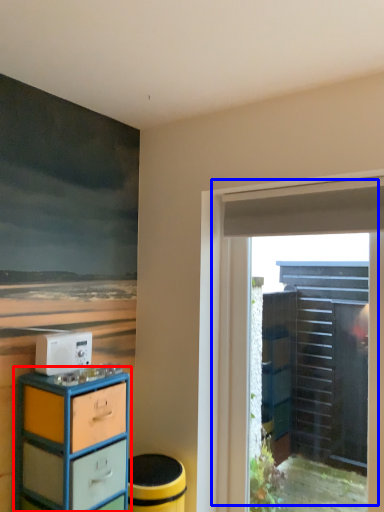
Question: Which point is closer to the camera, chest of drawers (highlighted by a red box) or door (highlighted by a blue box)?

Choices:
 (A) chest of drawers
 (B) door

Answer: (A)